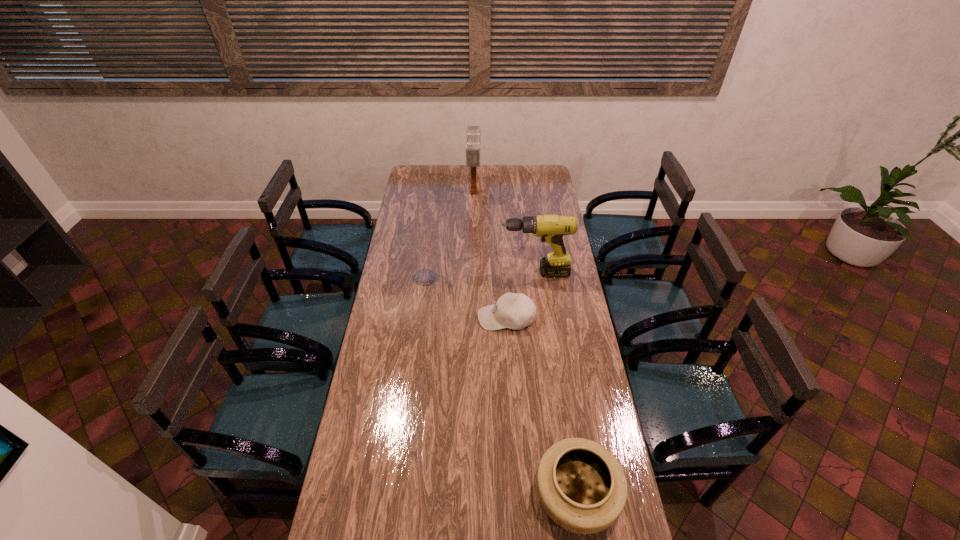
Locate an element on the screen. The width and height of the screenshot is (960, 540). vacant space situated 0.090m on the back of the leftmost object is located at coordinates (428, 255).

Find the location of a particular element. This screenshot has width=960, height=540. free location located on the front-facing side of the second nearest object is located at coordinates (464, 318).

Where is `free space located on the front-facing side of the second nearest object`? This screenshot has width=960, height=540. free space located on the front-facing side of the second nearest object is located at coordinates (436, 318).

The width and height of the screenshot is (960, 540). What are the coordinates of `free space located on the front-facing side of the second nearest object` in the screenshot? It's located at (402, 318).

Where is `object present at the far edge`? This screenshot has width=960, height=540. object present at the far edge is located at coordinates (473, 132).

The width and height of the screenshot is (960, 540). Find the location of `object at the left edge`. object at the left edge is located at coordinates (420, 241).

The image size is (960, 540). What are the coordinates of `object situated at the right edge` in the screenshot? It's located at (551, 228).

Identify the location of vacant space at the far edge of the desktop. The height and width of the screenshot is (540, 960). (482, 186).

Where is `vacant space at the left edge of the desktop`? The width and height of the screenshot is (960, 540). vacant space at the left edge of the desktop is located at coordinates (383, 289).

In the image, there is a desktop. Where is `vacant area at the right edge`? This screenshot has width=960, height=540. vacant area at the right edge is located at coordinates (540, 190).